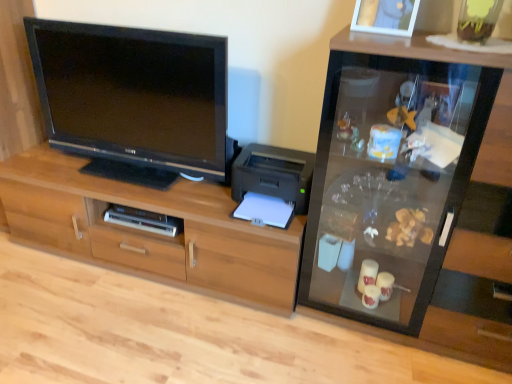
Question: Is wooden cabinet at center wider than transparent glass cabinet at right?

Choices:
 (A) no
 (B) yes

Answer: (B)

Question: Is wooden cabinet at center in front of transparent glass cabinet at right?

Choices:
 (A) no
 (B) yes

Answer: (A)

Question: From the image's perspective, is wooden cabinet at center under transparent glass cabinet at right?

Choices:
 (A) yes
 (B) no

Answer: (A)

Question: Is wooden cabinet at center far from transparent glass cabinet at right?

Choices:
 (A) no
 (B) yes

Answer: (A)

Question: Can you confirm if wooden cabinet at center is thinner than transparent glass cabinet at right?

Choices:
 (A) no
 (B) yes

Answer: (A)

Question: Is silver metallic dvd player at lower center wider or thinner than transparent glass cabinet at right?

Choices:
 (A) wide
 (B) thin

Answer: (B)

Question: From a real-world perspective, is silver metallic dvd player at lower center physically located above or below transparent glass cabinet at right?

Choices:
 (A) above
 (B) below

Answer: (B)

Question: Is silver metallic dvd player at lower center situated inside transparent glass cabinet at right or outside?

Choices:
 (A) inside
 (B) outside

Answer: (B)

Question: Considering the positions of point (152, 223) and point (477, 61), is point (152, 223) closer or farther from the camera than point (477, 61)?

Choices:
 (A) closer
 (B) farther

Answer: (B)

Question: Is silver metallic dvd player at lower center to the left or to the right of wooden cabinet at center in the image?

Choices:
 (A) left
 (B) right

Answer: (A)

Question: Considering the positions of silver metallic dvd player at lower center and wooden cabinet at center in the image, is silver metallic dvd player at lower center wider or thinner than wooden cabinet at center?

Choices:
 (A) wide
 (B) thin

Answer: (B)

Question: Choose the correct answer: Is silver metallic dvd player at lower center inside wooden cabinet at center or outside it?

Choices:
 (A) outside
 (B) inside

Answer: (B)

Question: Considering the positions of silver metallic dvd player at lower center and wooden cabinet at center in the image, is silver metallic dvd player at lower center bigger or smaller than wooden cabinet at center?

Choices:
 (A) big
 (B) small

Answer: (B)

Question: From a real-world perspective, relative to black plastic printer at center, is transparent glass cabinet at right vertically above or below?

Choices:
 (A) below
 (B) above

Answer: (B)

Question: In terms of width, does transparent glass cabinet at right look wider or thinner when compared to black plastic printer at center?

Choices:
 (A) thin
 (B) wide

Answer: (B)